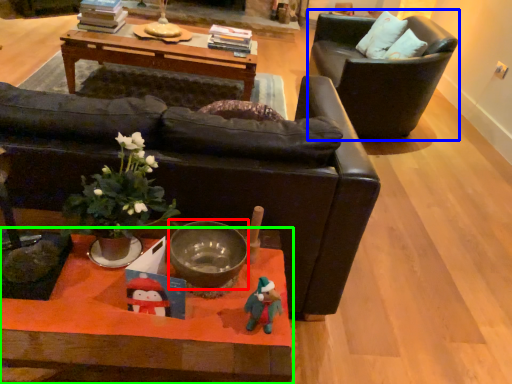
Question: Which is farther away from bowl (highlighted by a red box)? chair (highlighted by a blue box) or coffee table (highlighted by a green box)?

Choices:
 (A) chair
 (B) coffee table

Answer: (A)